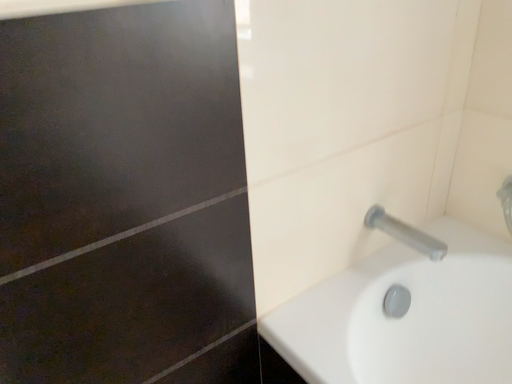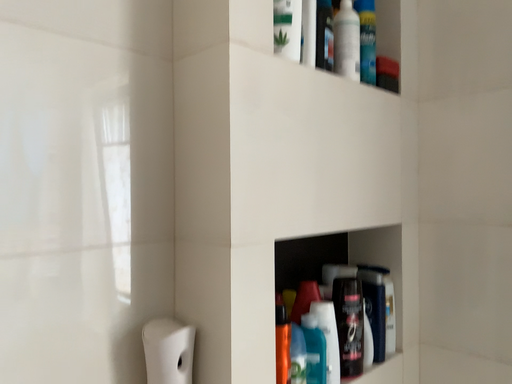
Question: Which way did the camera rotate in the video?

Choices:
 (A) rotated downward
 (B) rotated upward

Answer: (B)